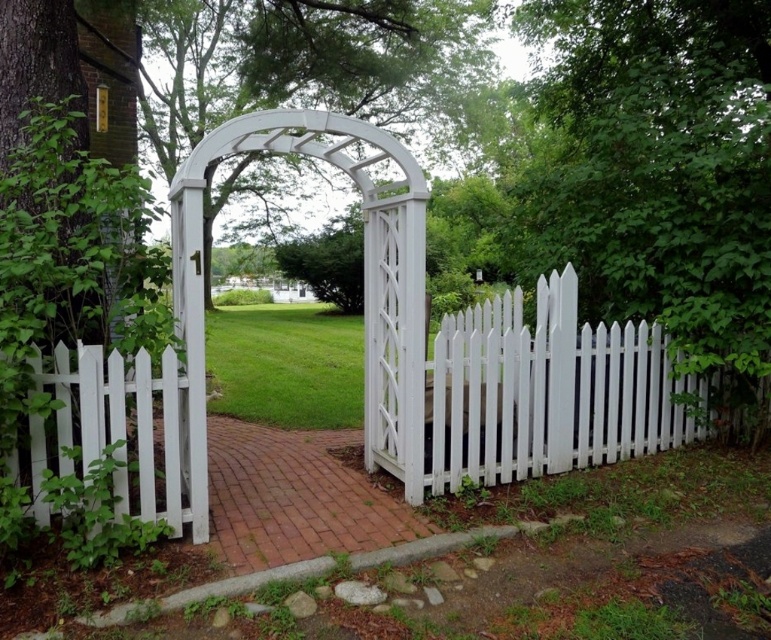
You are standing at the entrance of the garden and see the white picket fence at center and the white picket fence at left. Which one is positioned to the right of the other?

The white picket fence at center is positioned to the right of the white picket fence at left.

You are standing at the garden entrance and see the white picket fence at center and the white picket fence at left. Which one is positioned higher from the ground?

The white picket fence at center is positioned higher from the ground than the white picket fence at left.

You are standing at the garden entrance and want to walk through the open gate. There are two white picket fences in view. Which one is closer to you, the white picket fence at center or the white picket fence at left?

The white picket fence at left is closer to you because the white picket fence at center is 6.98 feet away from it, meaning the one at left is nearer.